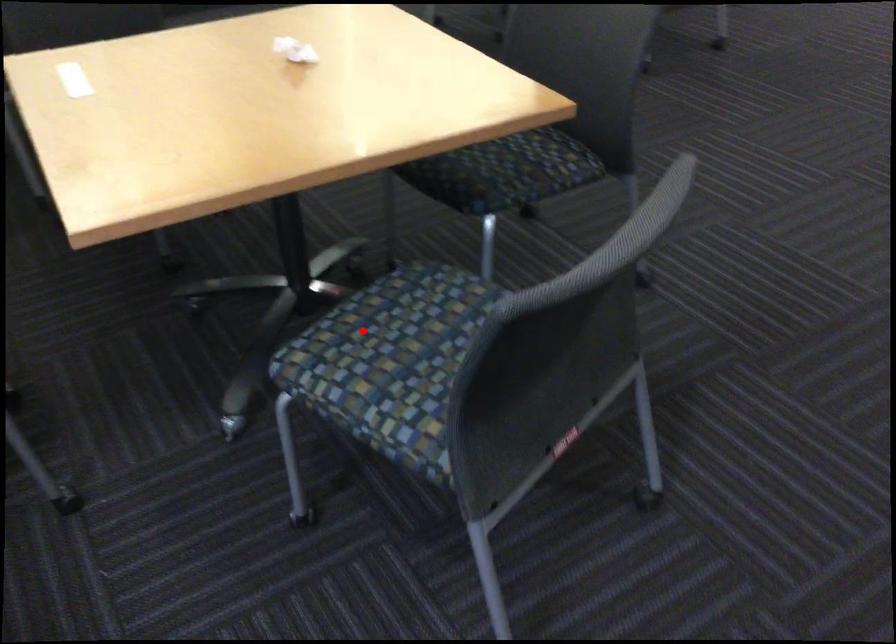
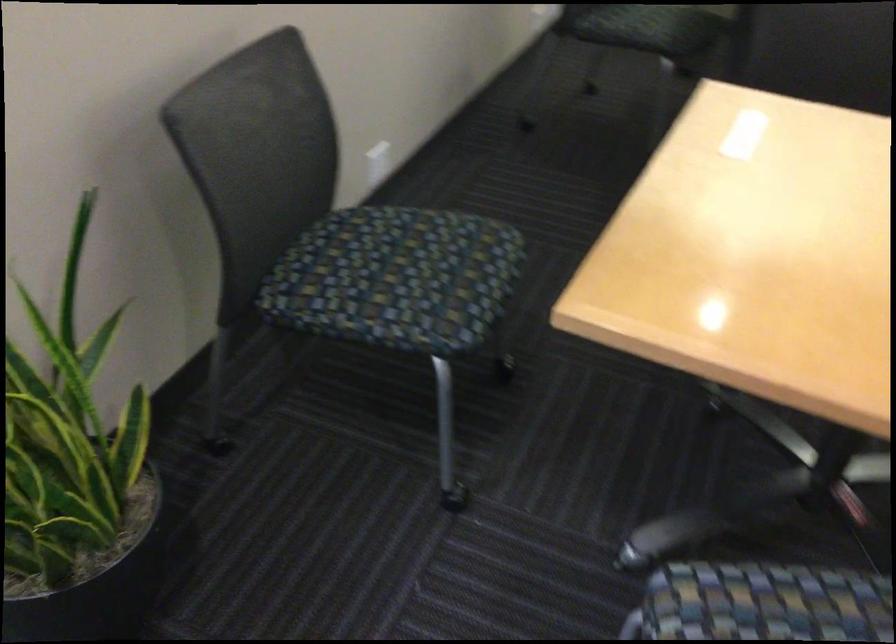
Question: I am providing you with two images of the same scene from different viewpoints. In image1, a red point is highlighted. Considering the same 3D point in image2, which of the following is correct?

Choices:
 (A) It is closer
 (B) It is farther

Answer: (A)